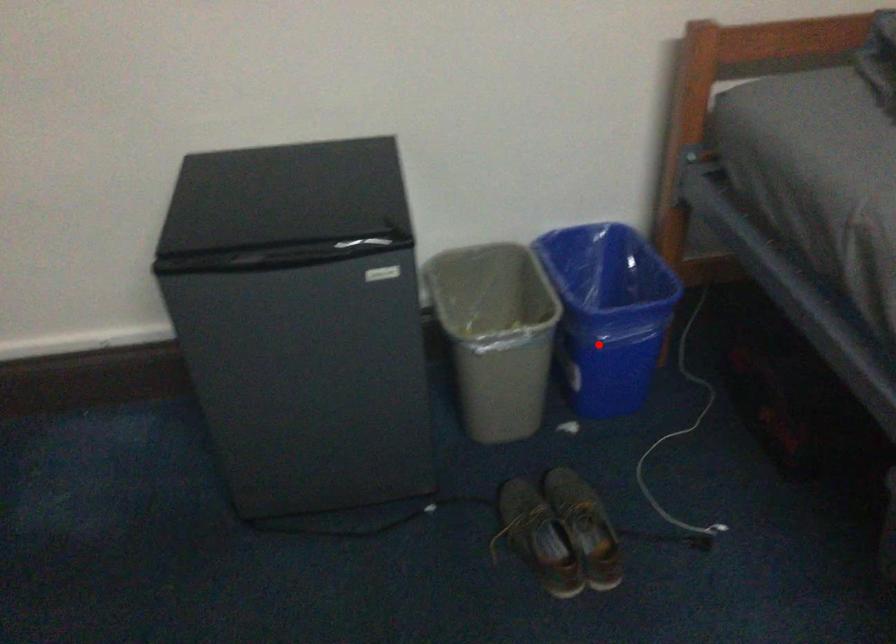
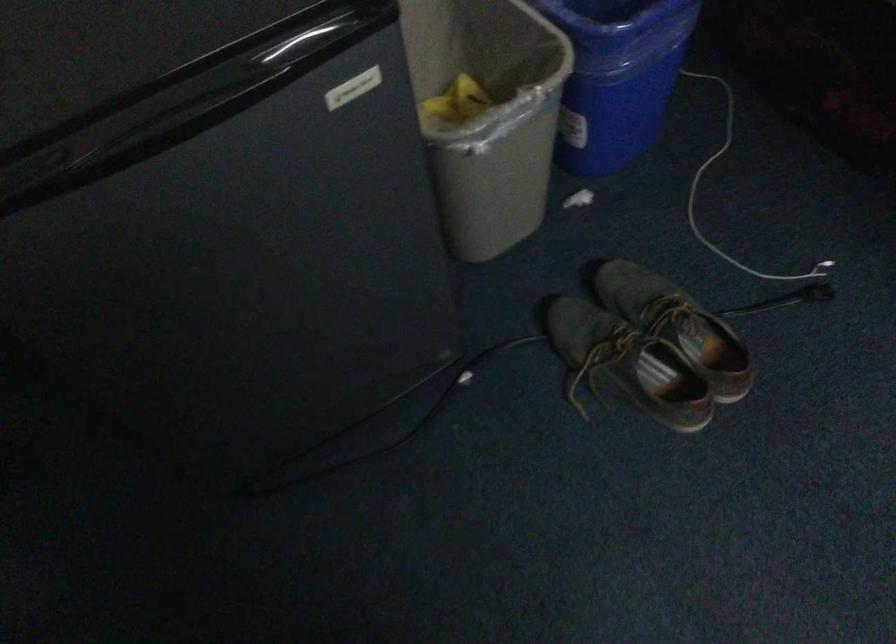
Question: A red point is marked in image1. In image2, is the corresponding 3D point closer to the camera or farther? Reply with the corresponding letter.

Choices:
 (A) The corresponding 3D point is closer.
 (B) The corresponding 3D point is farther.

Answer: (A)